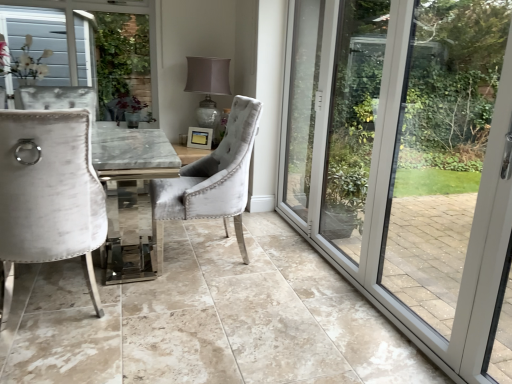
Identify the location of free space behind velvet grey chair at center, acting as the second chair starting from the left. This screenshot has width=512, height=384. (207, 228).